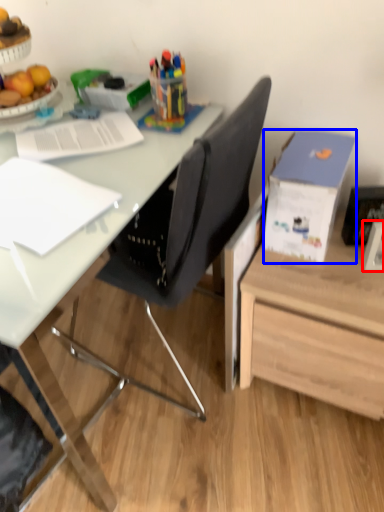
Question: Which of the following is the farthest to the observer, picture frame (highlighted by a red box) or box (highlighted by a blue box)?

Choices:
 (A) picture frame
 (B) box

Answer: (A)